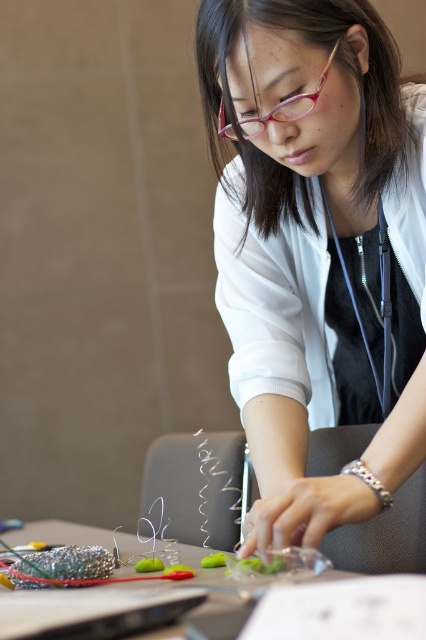
Is white matte shirt at center positioned before clear plastic table at lower center?

No, it is behind clear plastic table at lower center.

Does white matte shirt at center have a greater width compared to clear plastic table at lower center?

In fact, white matte shirt at center might be narrower than clear plastic table at lower center.

Does point (408, 300) lie in front of point (342, 600)?

No, it is behind (342, 600).

Locate an element on the screen. The image size is (426, 640). white matte shirt at center is located at coordinates (317, 250).